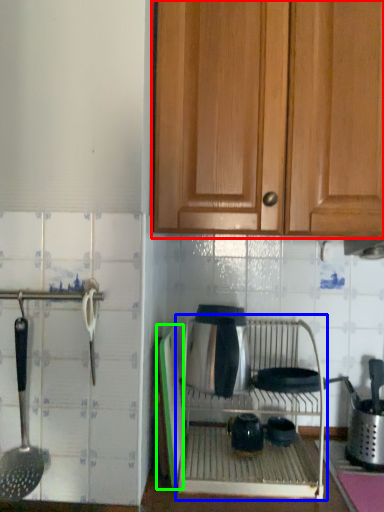
Question: Based on their relative distances, which object is farther from cabinetry (highlighted by a red box)? Choose from oven (highlighted by a blue box) and screen door (highlighted by a green box).

Choices:
 (A) oven
 (B) screen door

Answer: (A)